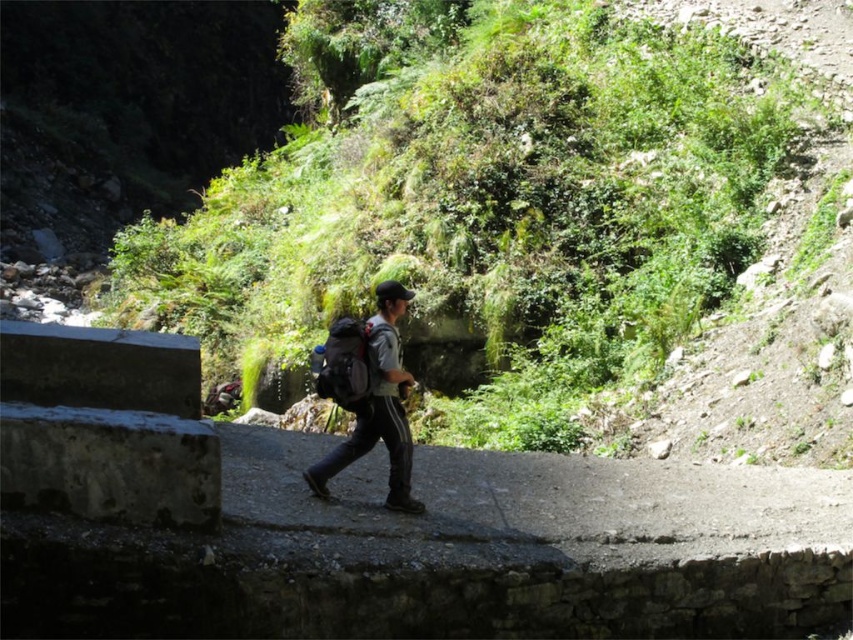
Question: Can you confirm if green leafy vegetation at center is positioned below matte gray backpack at center?

Choices:
 (A) no
 (B) yes

Answer: (A)

Question: In this image, where is gray fabric backpack at center located relative to matte gray backpack at center?

Choices:
 (A) below
 (B) above

Answer: (A)

Question: Which point is closer to the camera?

Choices:
 (A) green leafy vegetation at center
 (B) matte gray backpack at center

Answer: (B)

Question: Among these points, which one is farthest from the camera?

Choices:
 (A) (567, 67)
 (B) (335, 352)

Answer: (A)

Question: Does green leafy vegetation at center have a larger size compared to matte gray backpack at center?

Choices:
 (A) yes
 (B) no

Answer: (A)

Question: Among these points, which one is farthest from the camera?

Choices:
 (A) (389, 328)
 (B) (509, 132)
 (C) (398, 340)

Answer: (B)